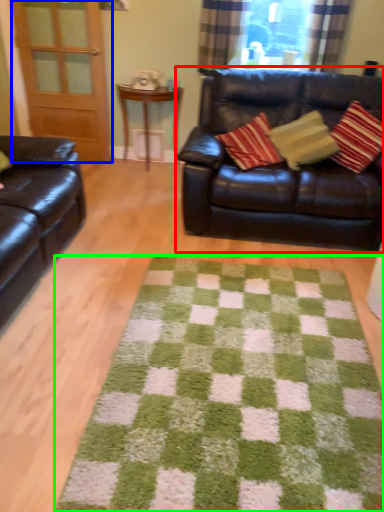
Question: Based on their relative distances, which object is nearer to studio couch (highlighted by a red box)? Choose from screen door (highlighted by a blue box) and doormat (highlighted by a green box).

Choices:
 (A) screen door
 (B) doormat

Answer: (B)